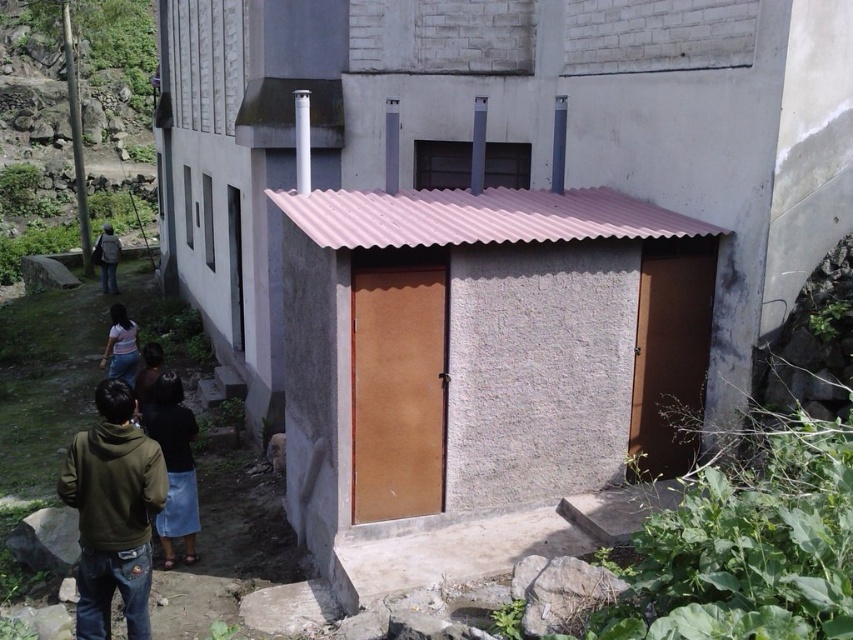
Does green matte hoodie at lower left have a larger size compared to light blue denim skirt at lower left?

No, green matte hoodie at lower left is not bigger than light blue denim skirt at lower left.

Between green matte hoodie at lower left and light blue denim skirt at lower left, which one appears on the left side from the viewer's perspective?

Positioned to the left is light blue denim skirt at lower left.

Does point (77, 600) come farther from viewer compared to point (126, 371)?

No, (77, 600) is closer to viewer.

Find the location of a particular element. This screenshot has width=853, height=640. green matte hoodie at lower left is located at coordinates click(x=113, y=513).

Who is more forward, (190, 410) or (140, 400)?

Point (140, 400) is more forward.

Can you confirm if dark blue denim skirt at lower center is positioned below dark brown hair at lower center?

Indeed, dark blue denim skirt at lower center is positioned under dark brown hair at lower center.

Describe the element at coordinates (173, 465) in the screenshot. The height and width of the screenshot is (640, 853). I see `dark blue denim skirt at lower center` at that location.

The width and height of the screenshot is (853, 640). Find the location of `dark blue denim skirt at lower center`. dark blue denim skirt at lower center is located at coordinates (173, 465).

Is green matte hoodie at lower left wider than dark blue jeans at left?

In fact, green matte hoodie at lower left might be narrower than dark blue jeans at left.

Between green matte hoodie at lower left and dark blue jeans at left, which one has less height?

With less height is dark blue jeans at left.

Does point (103, 596) come farther from viewer compared to point (112, 232)?

No, (103, 596) is in front of (112, 232).

Locate an element on the screen. This screenshot has height=640, width=853. green matte hoodie at lower left is located at coordinates (113, 513).